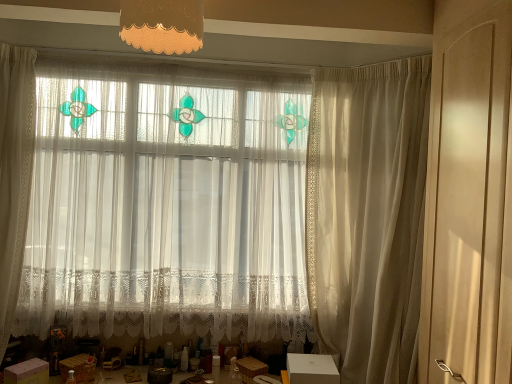
Question: Can you confirm if white cardboard box at lower left, which is the 1th cardboard box in left-to-right order, is taller than white cardboard box at lower center, the 3th cardboard box viewed from the left?

Choices:
 (A) yes
 (B) no

Answer: (A)

Question: From the image's perspective, is white cardboard box at lower left, which is the 1th cardboard box in left-to-right order, on top of white cardboard box at lower center, which is the first cardboard box from right to left?

Choices:
 (A) yes
 (B) no

Answer: (B)

Question: Does white cardboard box at lower left, which is the third cardboard box in right-to-left order, turn towards white cardboard box at lower center, which is the first cardboard box from right to left?

Choices:
 (A) yes
 (B) no

Answer: (B)

Question: Is white cardboard box at lower left, which is the 1th cardboard box in left-to-right order, further to the viewer compared to white cardboard box at lower center, the 3th cardboard box viewed from the left?

Choices:
 (A) yes
 (B) no

Answer: (B)

Question: Considering the relative positions of white cardboard box at lower left, which is the third cardboard box in right-to-left order, and white cardboard box at lower center, the 3th cardboard box viewed from the left, in the image provided, is white cardboard box at lower left, which is the third cardboard box in right-to-left order, to the left of white cardboard box at lower center, the 3th cardboard box viewed from the left, from the viewer's perspective?

Choices:
 (A) yes
 (B) no

Answer: (A)

Question: Based on their sizes in the image, would you say white lace curtain at center, which is the 2th curtain from right to left, is bigger or smaller than white cardboard box at lower center, which is the first cardboard box from right to left?

Choices:
 (A) small
 (B) big

Answer: (B)

Question: Is point (96, 183) positioned closer to the camera than point (295, 374)?

Choices:
 (A) closer
 (B) farther

Answer: (B)

Question: In the image, is white lace curtain at center, which is the 2th curtain from right to left, positioned in front of or behind white cardboard box at lower center, which is the first cardboard box from right to left?

Choices:
 (A) front
 (B) behind

Answer: (B)

Question: Is white lace curtain at center, positioned as the 1th curtain in left-to-right order, wider or thinner than white cardboard box at lower center, the 3th cardboard box viewed from the left?

Choices:
 (A) wide
 (B) thin

Answer: (B)

Question: In terms of height, does sheer white curtain at right, which ranks as the second curtain in left-to-right order, look taller or shorter compared to matte brown cardboard box at lower left, which appears as the second cardboard box when viewed from the right?

Choices:
 (A) tall
 (B) short

Answer: (A)

Question: In the image, is sheer white curtain at right, the 1th curtain positioned from the right, on the left side or the right side of matte brown cardboard box at lower left, which appears as the second cardboard box when viewed from the right?

Choices:
 (A) right
 (B) left

Answer: (A)

Question: Is sheer white curtain at right, the 1th curtain positioned from the right, wider or thinner than matte brown cardboard box at lower left, which appears as the second cardboard box when viewed from the right?

Choices:
 (A) thin
 (B) wide

Answer: (B)

Question: Considering the positions of point (406, 102) and point (79, 365), is point (406, 102) closer or farther from the camera than point (79, 365)?

Choices:
 (A) farther
 (B) closer

Answer: (B)

Question: Is point (357, 228) closer or farther from the camera than point (39, 370)?

Choices:
 (A) farther
 (B) closer

Answer: (A)

Question: From the image's perspective, relative to white cardboard box at lower left, which is the third cardboard box in right-to-left order, is sheer white curtain at right, the 1th curtain positioned from the right, above or below?

Choices:
 (A) below
 (B) above

Answer: (B)